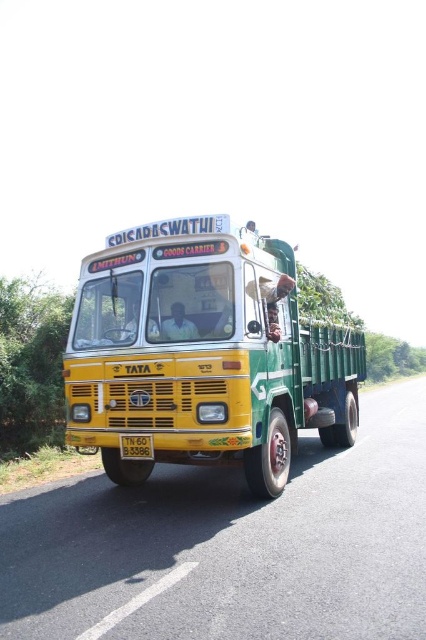
Based on the photo, you are a passenger sitting on the roof of the yellow metallic truck at center. You want to reach the white plastic license plate at center to read its number. Is the license plate above or below you?

The white plastic license plate at center is above you since the yellow metallic truck at center is located below it.